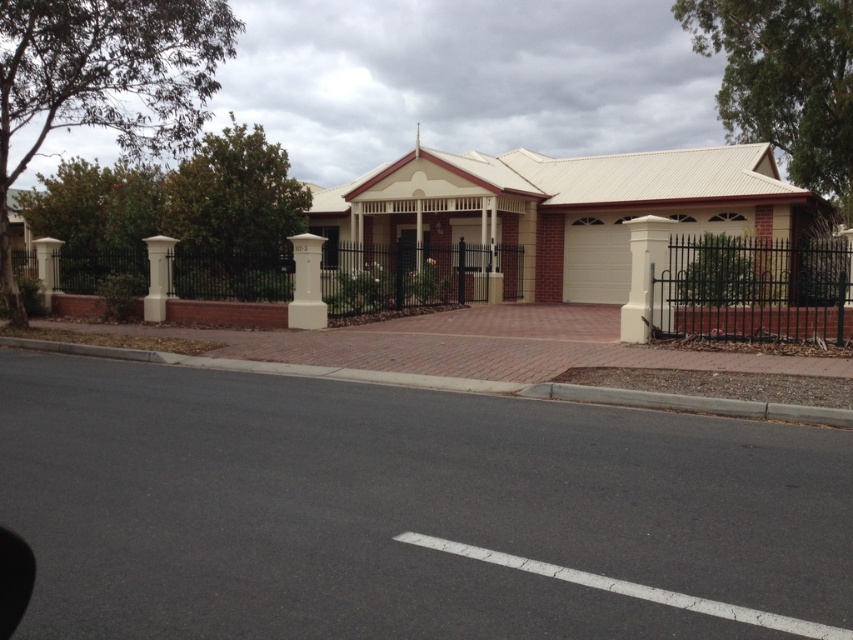
Is white smooth pillar at center thinner than white smooth post at left?

Correct, white smooth pillar at center's width is less than white smooth post at left's.

Who is lower down, white smooth pillar at center or white smooth post at left?

white smooth pillar at center is below.

Which is behind, point (643, 244) or point (155, 285)?

The point (155, 285) is more distant.

Find the location of a particular element. The image size is (853, 640). white smooth pillar at center is located at coordinates (645, 276).

Which is below, white smooth post at center or white smooth pillar at left?

Positioned lower is white smooth post at center.

The width and height of the screenshot is (853, 640). What do you see at coordinates (306, 284) in the screenshot? I see `white smooth post at center` at bounding box center [306, 284].

The image size is (853, 640). Find the location of `white smooth post at center`. white smooth post at center is located at coordinates (306, 284).

Does white smooth post at left have a greater height compared to white smooth pillar at left?

Correct, white smooth post at left is much taller as white smooth pillar at left.

From the picture: Is white smooth post at left closer to camera compared to white smooth pillar at left?

That is True.

Locate an element on the screen. The image size is (853, 640). white smooth post at left is located at coordinates (158, 276).